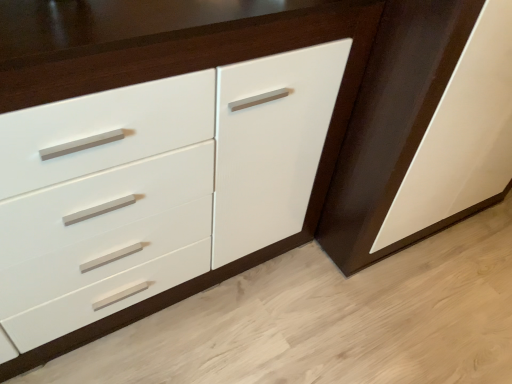
Identify the location of white glossy cabinet at center. (461, 135).

This screenshot has width=512, height=384. Describe the element at coordinates (461, 135) in the screenshot. I see `white glossy cabinet at center` at that location.

The width and height of the screenshot is (512, 384). Find the location of `white glossy cabinet at center`. white glossy cabinet at center is located at coordinates (461, 135).